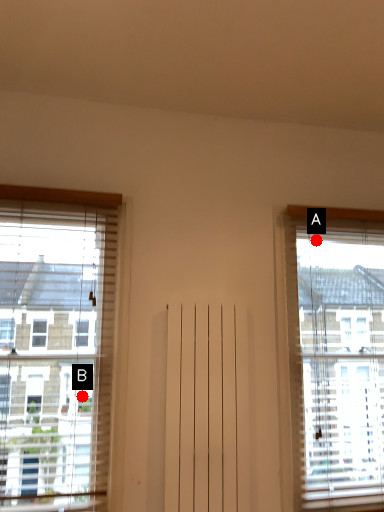
Question: Two points are circled on the image, labeled by A and B beside each circle. Which point is closer to the camera?

Choices:
 (A) A is closer
 (B) B is closer

Answer: (B)